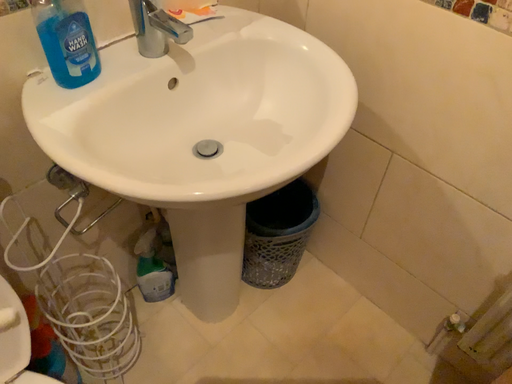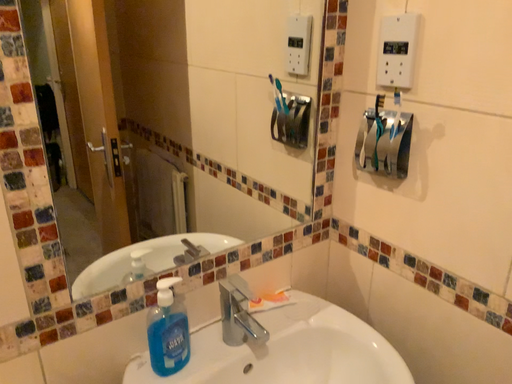
Question: Which way did the camera rotate in the video?

Choices:
 (A) rotated downward
 (B) rotated upward

Answer: (B)